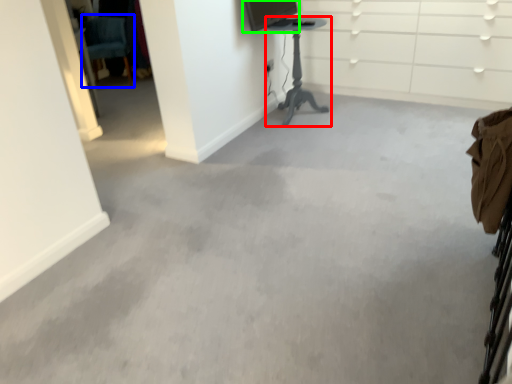
Question: Which is farther away from furniture (highlighted by a red box)? swivel chair (highlighted by a blue box) or computer monitor (highlighted by a green box)?

Choices:
 (A) swivel chair
 (B) computer monitor

Answer: (A)